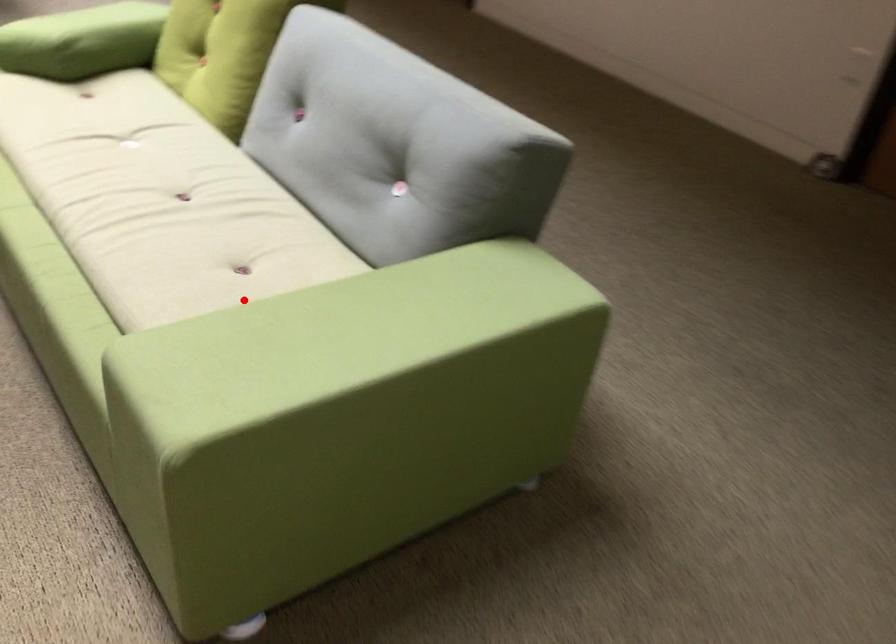
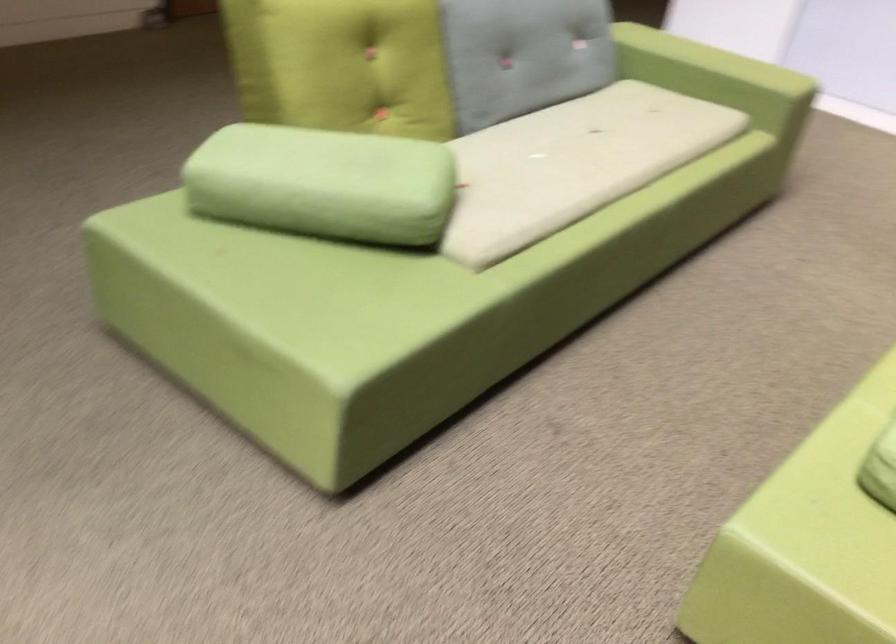
In the second image, find the point that corresponds to the highlighted location in the first image.

(717, 77)